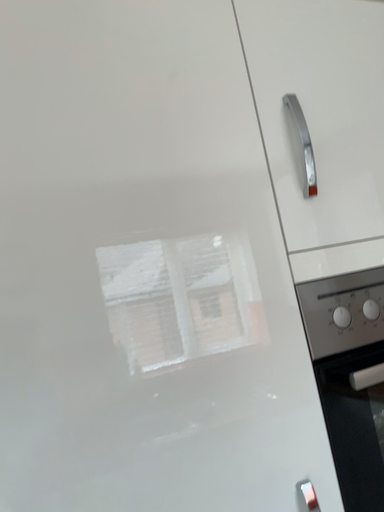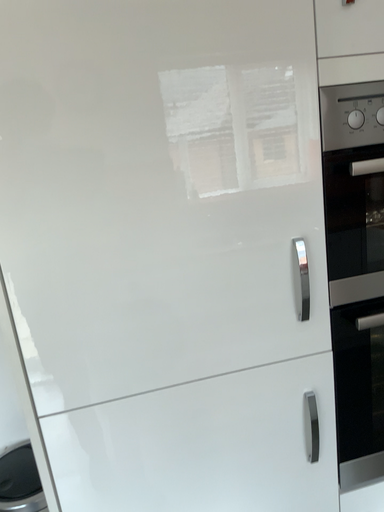
Question: How did the camera likely rotate when shooting the video?

Choices:
 (A) rotated left
 (B) rotated right

Answer: (A)